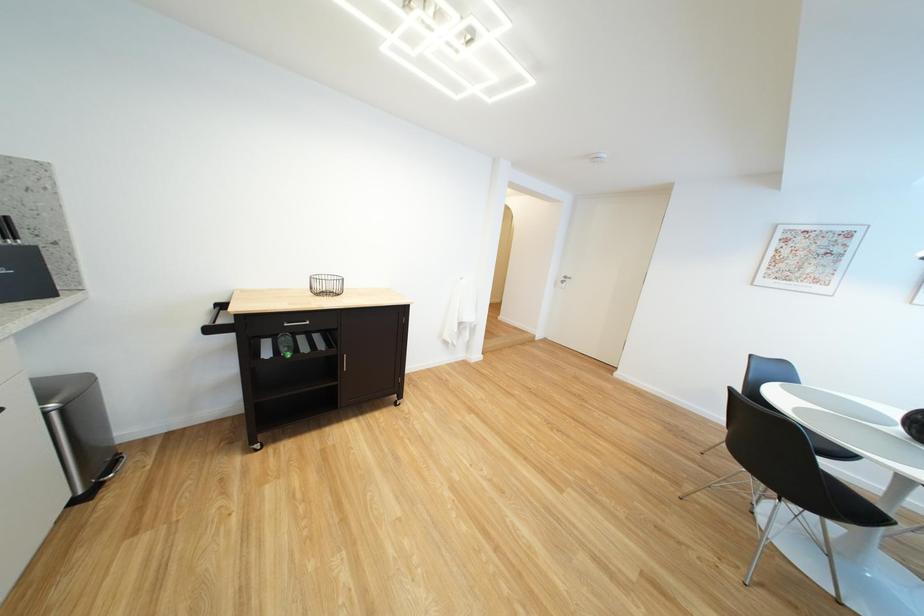
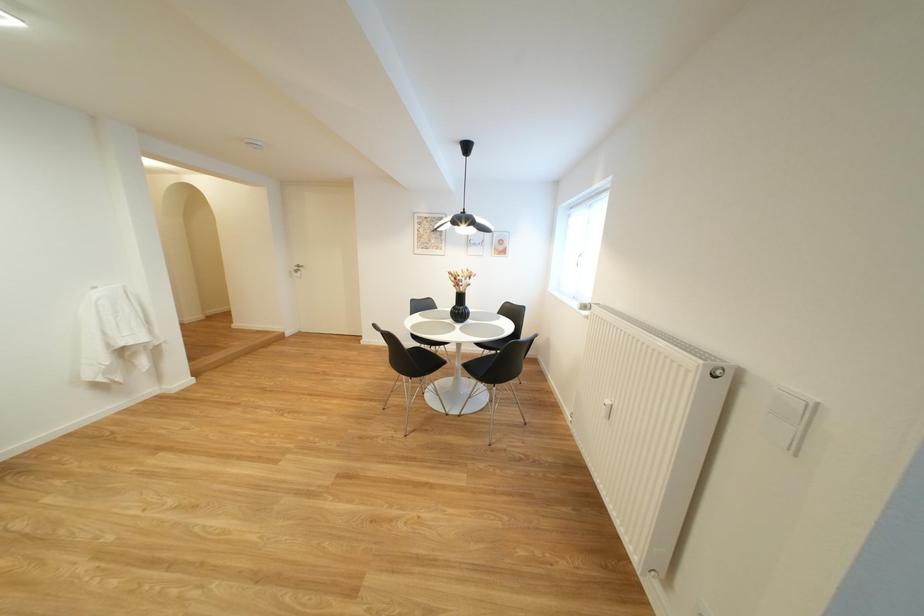
Question: How did the camera likely rotate?

Choices:
 (A) Left
 (B) Right
 (C) Up
 (D) Down

Answer: (B)